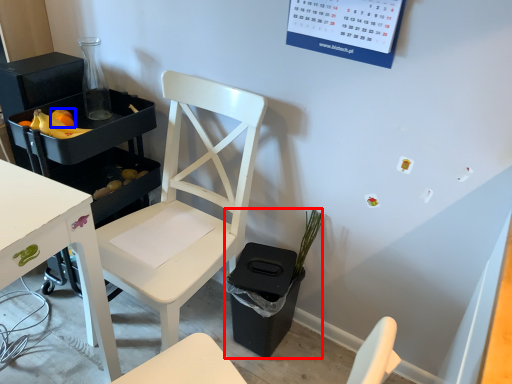
Question: Which object appears closest to the camera in this image, houseplant (highlighted by a red box) or fruit (highlighted by a blue box)?

Choices:
 (A) houseplant
 (B) fruit

Answer: (A)